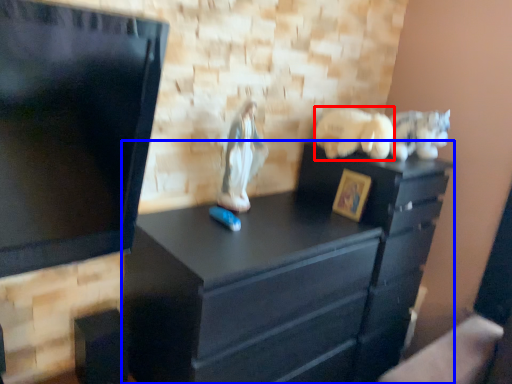
Question: Which object appears farthest to the camera in this image, animal (highlighted by a red box) or chest of drawers (highlighted by a blue box)?

Choices:
 (A) animal
 (B) chest of drawers

Answer: (A)